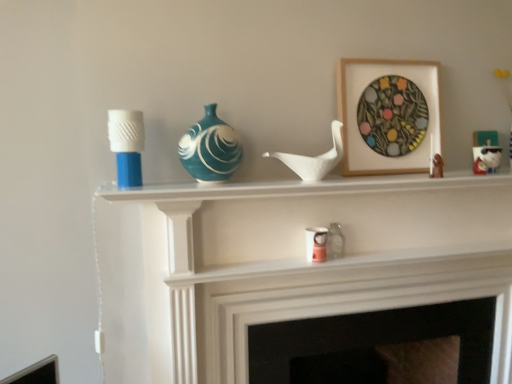
This screenshot has height=384, width=512. In order to click on free point above white glossy shelf at upper center (from a real-world perspective) in this screenshot , I will do `click(316, 184)`.